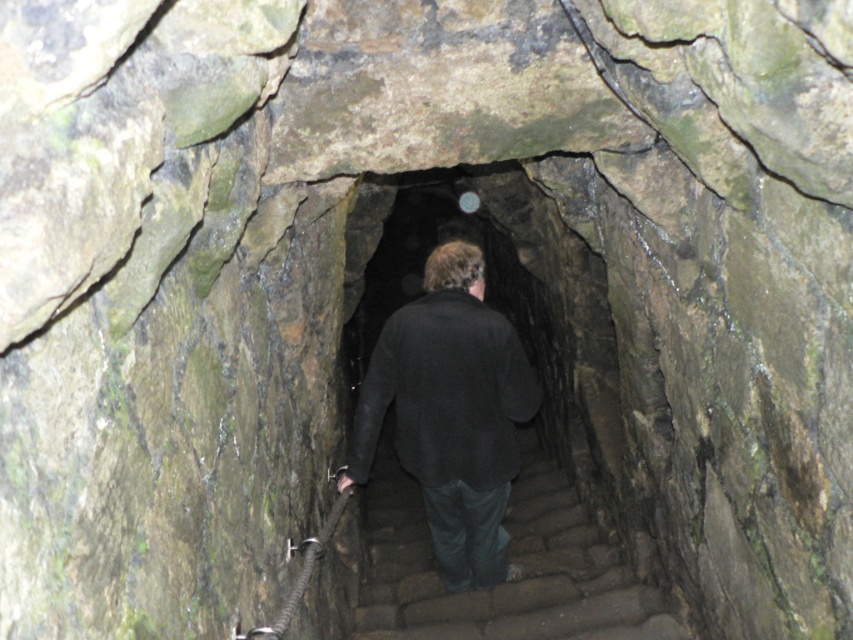
Question: Which point is farther from the camera taking this photo?

Choices:
 (A) (393, 496)
 (B) (537, 408)

Answer: (A)

Question: In this image, where is black matte jacket at center located relative to brown stone stairs at center?

Choices:
 (A) above
 (B) below

Answer: (A)

Question: Can you confirm if black matte jacket at center is positioned below brown stone stairs at center?

Choices:
 (A) no
 (B) yes

Answer: (A)

Question: Is black matte jacket at center thinner than brown stone stairs at center?

Choices:
 (A) no
 (B) yes

Answer: (B)